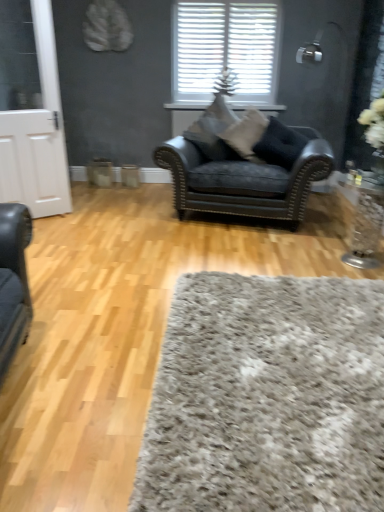
Question: From the image's perspective, does suede-like beige pillow at center, which ranks as the second pillow in left-to-right order, appear lower than velvet black armchair at center?

Choices:
 (A) yes
 (B) no

Answer: (B)

Question: Can you confirm if suede-like beige pillow at center, which ranks as the second pillow in left-to-right order, is thinner than velvet black armchair at center?

Choices:
 (A) yes
 (B) no

Answer: (A)

Question: From a real-world perspective, is suede-like beige pillow at center, marked as the 2th pillow in a right-to-left arrangement, on velvet black armchair at center?

Choices:
 (A) yes
 (B) no

Answer: (A)

Question: Considering the relative sizes of suede-like beige pillow at center, marked as the 2th pillow in a right-to-left arrangement, and velvet black armchair at center in the image provided, is suede-like beige pillow at center, marked as the 2th pillow in a right-to-left arrangement, wider than velvet black armchair at center?

Choices:
 (A) no
 (B) yes

Answer: (A)

Question: From the image's perspective, would you say suede-like beige pillow at center, marked as the 2th pillow in a right-to-left arrangement, is positioned over velvet black armchair at center?

Choices:
 (A) no
 (B) yes

Answer: (B)

Question: Is suede-like beige pillow at center, which ranks as the second pillow in left-to-right order, to the right of velvet black armchair at center from the viewer's perspective?

Choices:
 (A) yes
 (B) no

Answer: (A)

Question: Would you say black leather pillow at center, placed as the 3th pillow when sorted from left to right, is outside clear glass vase at right?

Choices:
 (A) no
 (B) yes

Answer: (B)

Question: Is black leather pillow at center, placed as the 3th pillow when sorted from left to right, oriented away from clear glass vase at right?

Choices:
 (A) no
 (B) yes

Answer: (A)

Question: From the image's perspective, is black leather pillow at center, the 1th pillow in the right-to-left sequence, on top of clear glass vase at right?

Choices:
 (A) yes
 (B) no

Answer: (A)

Question: From the image's perspective, does black leather pillow at center, the 1th pillow in the right-to-left sequence, appear lower than clear glass vase at right?

Choices:
 (A) no
 (B) yes

Answer: (A)

Question: Is black leather pillow at center, the 1th pillow in the right-to-left sequence, next to clear glass vase at right and touching it?

Choices:
 (A) yes
 (B) no

Answer: (B)

Question: Is black leather pillow at center, placed as the 3th pillow when sorted from left to right, to the right of clear glass vase at right from the viewer's perspective?

Choices:
 (A) no
 (B) yes

Answer: (A)

Question: From a real-world perspective, is black leather pillow at center, the 1th pillow in the right-to-left sequence, located higher than suede-like gray pillow at center, which is the 1th pillow in left-to-right order?

Choices:
 (A) no
 (B) yes

Answer: (A)